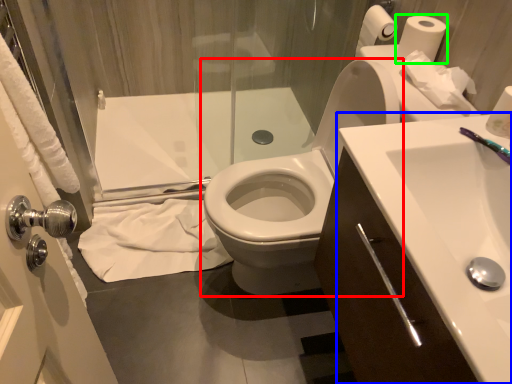
Question: Estimate the real-world distances between objects in this image. Which object is farther from toilet (highlighted by a red box), sink (highlighted by a blue box) or toilet paper (highlighted by a green box)?

Choices:
 (A) sink
 (B) toilet paper

Answer: (B)